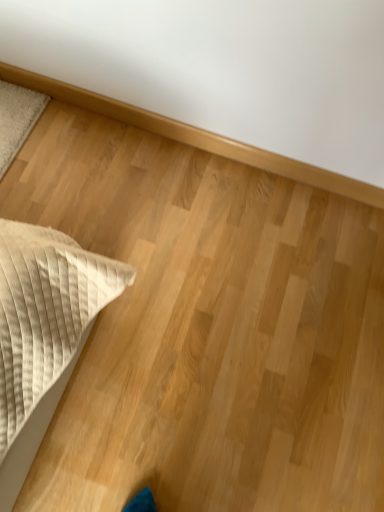
Image resolution: width=384 pixels, height=512 pixels. Find the location of `natural wood baseboard at upper center`. natural wood baseboard at upper center is located at coordinates (196, 136).

Consider the image. What is the approximate width of natural wood baseboard at upper center?

natural wood baseboard at upper center is 1.34 inches wide.

Describe the element at coordinates (196, 136) in the screenshot. Image resolution: width=384 pixels, height=512 pixels. I see `natural wood baseboard at upper center` at that location.

You are a GUI agent. You are given a task and a screenshot of the screen. Output one action in this format:
    pyautogui.click(x=<x>, y=<y>)
    Task: Click on the natural wood baseboard at upper center
    This screenshot has width=384, height=512.
    Given the screenshot: What is the action you would take?
    pyautogui.click(x=196, y=136)